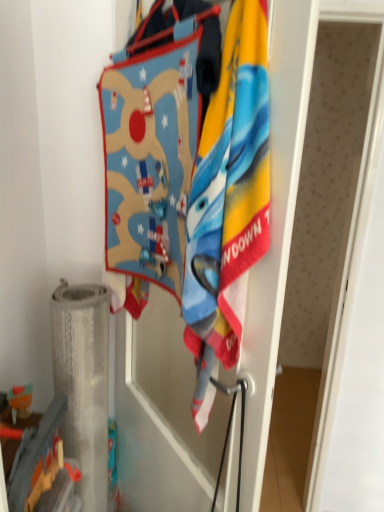
Question: Is there a large distance between metallic silver toy at lower left and soft cotton towel at center?

Choices:
 (A) no
 (B) yes

Answer: (A)

Question: Could you tell me if metallic silver toy at lower left is turned towards soft cotton towel at center?

Choices:
 (A) no
 (B) yes

Answer: (A)

Question: Does metallic silver toy at lower left have a lesser height compared to soft cotton towel at center?

Choices:
 (A) no
 (B) yes

Answer: (B)

Question: Is metallic silver toy at lower left smaller than soft cotton towel at center?

Choices:
 (A) no
 (B) yes

Answer: (B)

Question: Is metallic silver toy at lower left placed right next to soft cotton towel at center?

Choices:
 (A) yes
 (B) no

Answer: (B)

Question: Considering the relative sizes of metallic silver toy at lower left and soft cotton towel at center in the image provided, is metallic silver toy at lower left taller than soft cotton towel at center?

Choices:
 (A) no
 (B) yes

Answer: (A)

Question: Is soft cotton towel at center smaller than metallic silver toy at lower left?

Choices:
 (A) yes
 (B) no

Answer: (B)

Question: Are soft cotton towel at center and metallic silver toy at lower left located far from each other?

Choices:
 (A) yes
 (B) no

Answer: (B)

Question: Does soft cotton towel at center contain metallic silver toy at lower left?

Choices:
 (A) no
 (B) yes

Answer: (A)

Question: From the image's perspective, is soft cotton towel at center under metallic silver toy at lower left?

Choices:
 (A) no
 (B) yes

Answer: (A)

Question: Does soft cotton towel at center have a lesser width compared to metallic silver toy at lower left?

Choices:
 (A) yes
 (B) no

Answer: (A)

Question: Is soft cotton towel at center outside of metallic silver toy at lower left?

Choices:
 (A) no
 (B) yes

Answer: (B)

Question: Looking at their shapes, would you say metallic silver toy at lower left is wider or thinner than soft cotton towel at center?

Choices:
 (A) thin
 (B) wide

Answer: (B)